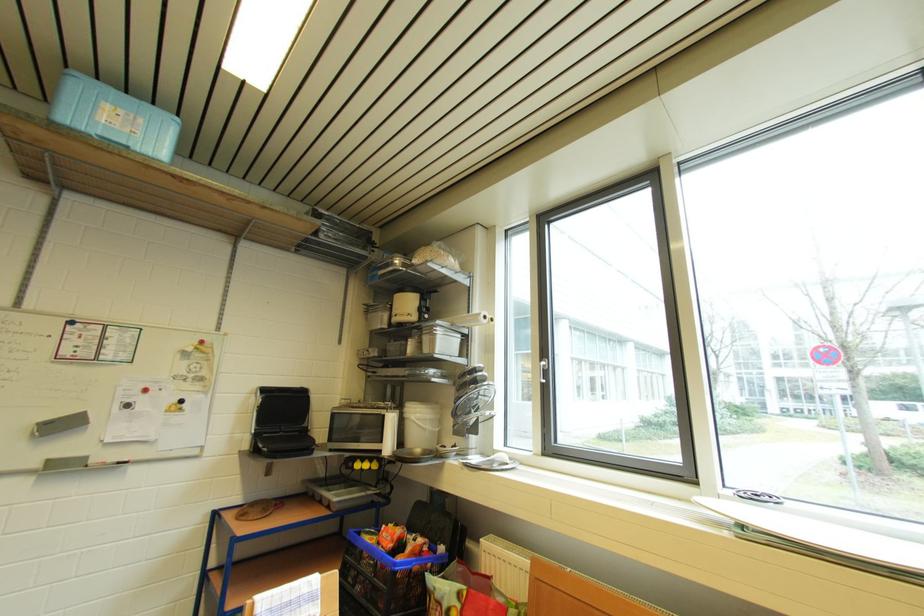
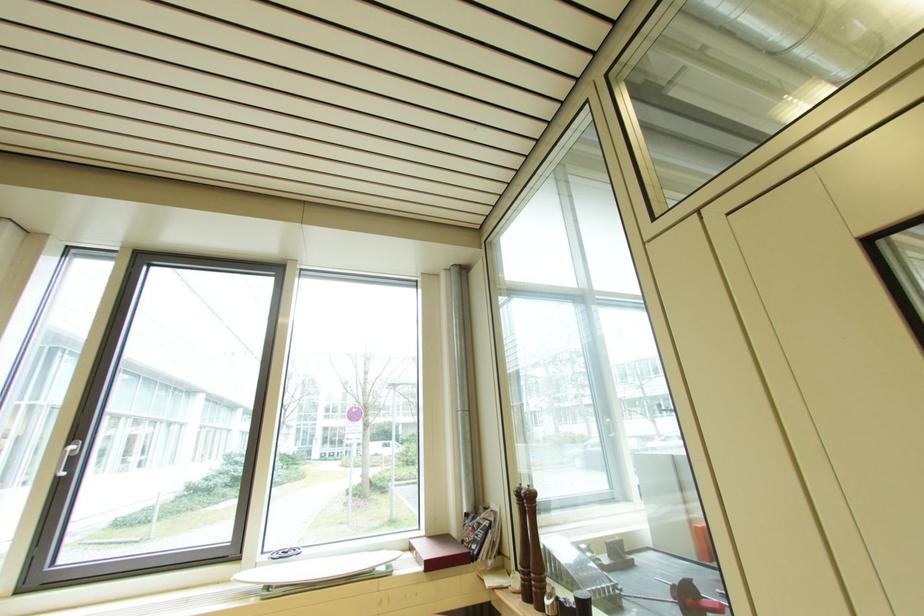
Where in the second image is the point corresponding to [546,369] from the first image?

(73, 455)